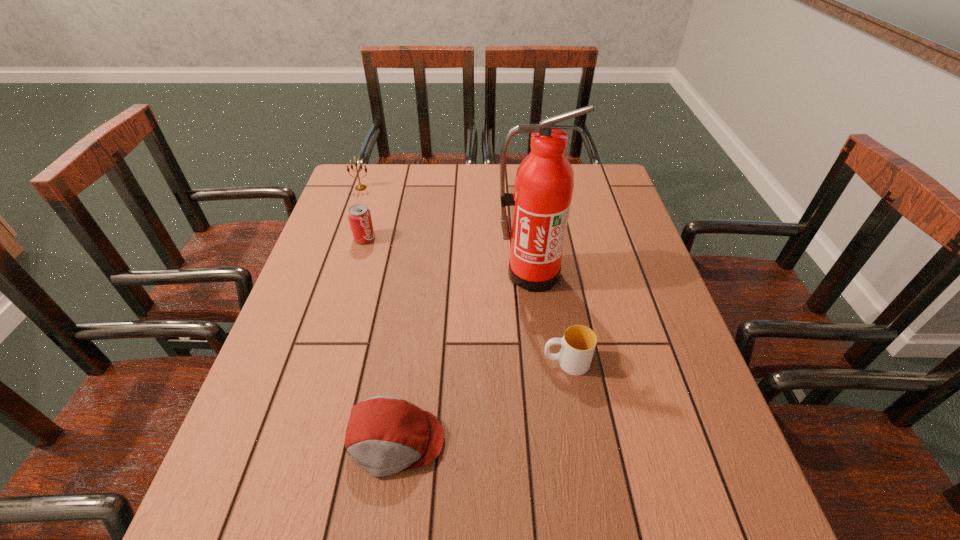
Identify the location of vacant area situated with the handle on the side of the cup. (441, 362).

Image resolution: width=960 pixels, height=540 pixels. I want to click on free space located 0.080m with the handle on the side of the cup, so click(x=506, y=362).

This screenshot has width=960, height=540. Identify the location of vacant space located 0.120m with the handle on the side of the cup. (487, 362).

This screenshot has width=960, height=540. Find the location of `vacant space located 0.090m on the front-facing side of the cap`. vacant space located 0.090m on the front-facing side of the cap is located at coordinates [x=382, y=536].

The height and width of the screenshot is (540, 960). In order to click on object present at the far edge in this screenshot , I will do `click(360, 187)`.

In order to click on candelabrum situated at the left edge in this screenshot , I will do `click(360, 187)`.

Where is `soda can that is at the left edge`? soda can that is at the left edge is located at coordinates (359, 216).

Identify the location of object located in the far left corner section of the desktop. The width and height of the screenshot is (960, 540). (360, 187).

In the image, there is a desktop. At what (x,y) coordinates should I click in order to perform the action: click on free region at the far edge. Please return your answer as a coordinate pair (x, y). Looking at the image, I should click on (425, 173).

Image resolution: width=960 pixels, height=540 pixels. In order to click on vacant region at the near edge of the desktop in this screenshot , I will do `click(595, 537)`.